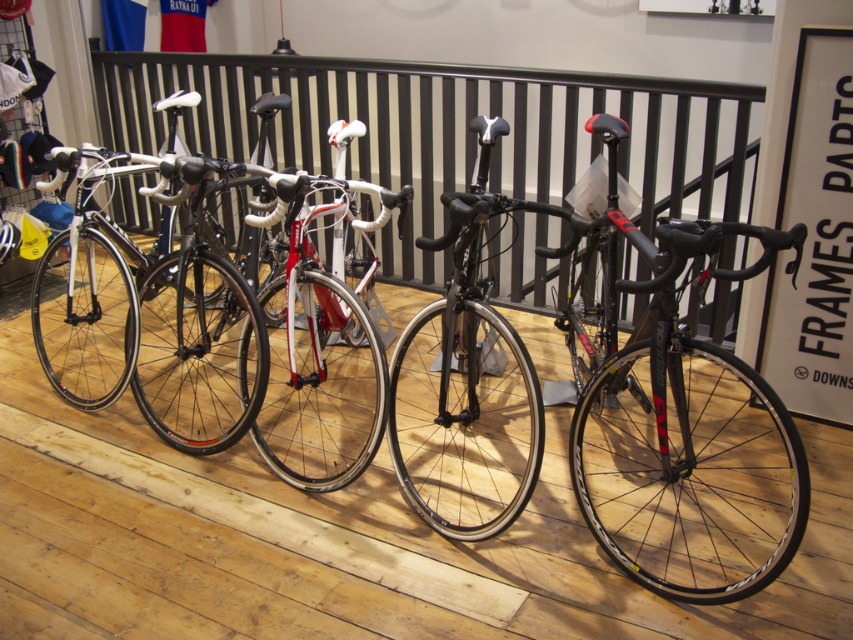
Which is above, shiny black bike at center or shiny black frame at center?

shiny black bike at center is above.

Image resolution: width=853 pixels, height=640 pixels. I want to click on shiny black bike at center, so click(x=511, y=381).

Which is in front, point (289, 307) or point (704, 556)?

Point (704, 556) is in front.

Identify the location of shiny black bike at center. This screenshot has height=640, width=853. (511, 381).

From the picture: Does black matte bicycle at center appear under matte black bike at center?

Correct, black matte bicycle at center is located below matte black bike at center.

Does black matte bicycle at center have a smaller size compared to matte black bike at center?

Indeed, black matte bicycle at center has a smaller size compared to matte black bike at center.

Is point (467, 355) positioned in front of point (219, 269)?

Yes, it is.

The image size is (853, 640). In order to click on black matte bicycle at center in this screenshot , I will do `click(465, 385)`.

Can you confirm if shiny red bike at center is wider than matte black bike at center?

In fact, shiny red bike at center might be narrower than matte black bike at center.

Is shiny red bike at center positioned behind matte black bike at center?

No, it is not.

Is point (341, 273) positioned before point (148, 419)?

No, (341, 273) is further to viewer.

Find the location of a particular element. The width and height of the screenshot is (853, 640). shiny red bike at center is located at coordinates (325, 337).